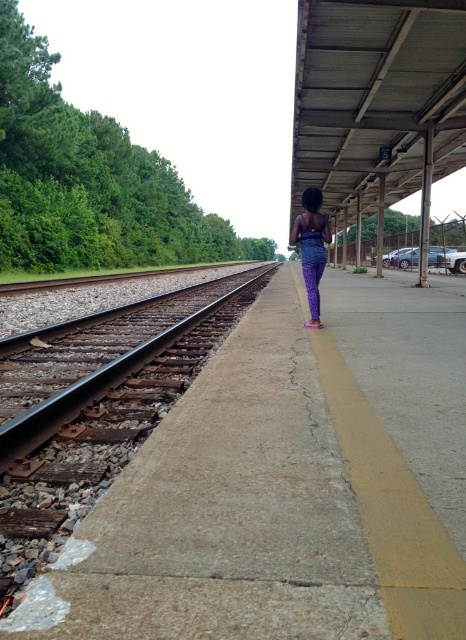
You are standing on the platform and want to walk to the purple fabric pants at center without stepping on the brown gravel track at left. Is this possible?

The brown gravel track at left is above the purple fabric pants at center, so you can walk to the purple fabric pants at center without stepping on the brown gravel track at left by moving around it.